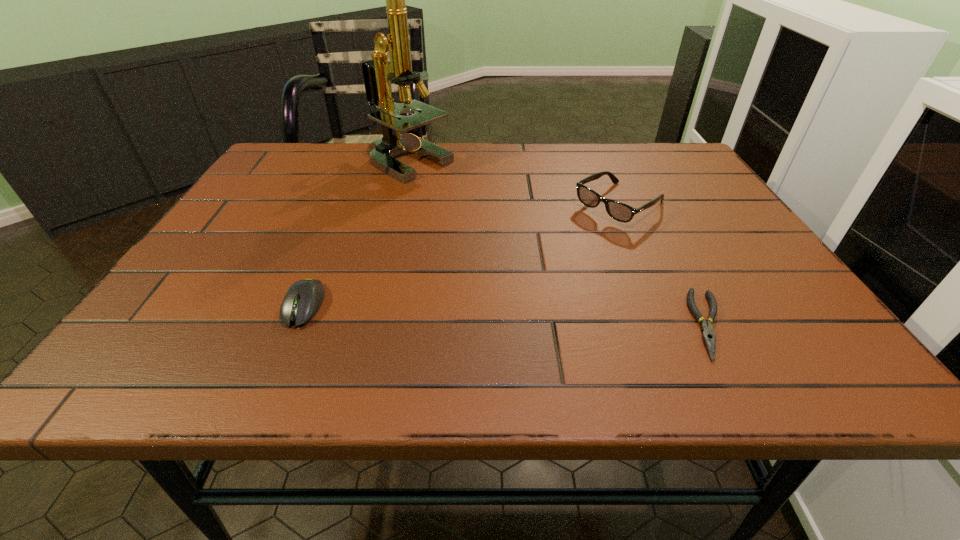
Image resolution: width=960 pixels, height=540 pixels. In order to click on free spot on the desktop that is between the third tallest object and the shortest object and is positioned at the eyepiece of the microscope in this screenshot , I will do `click(501, 314)`.

Locate an element on the screen. vacant spot on the desktop that is between the third tallest object and the pliers and is positioned on the lenses of the spectacles is located at coordinates (458, 312).